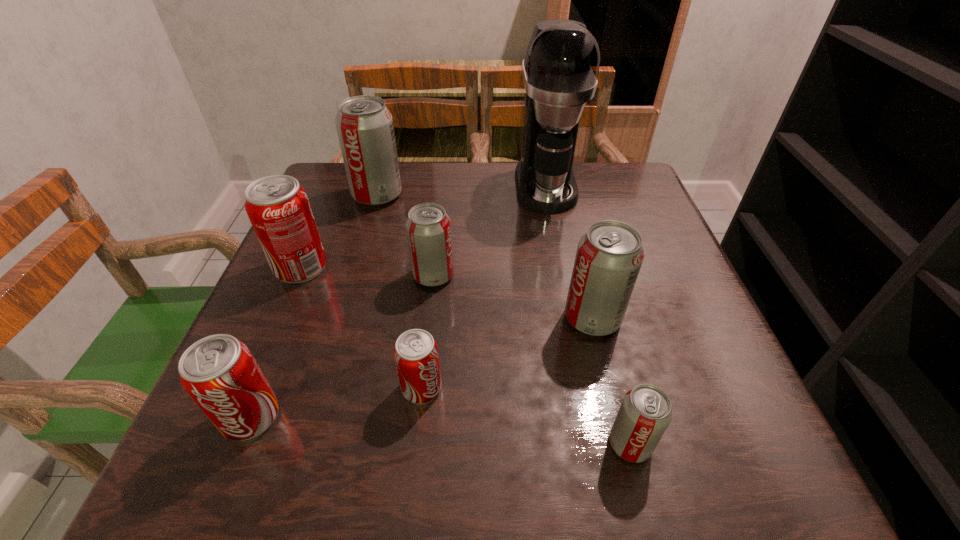
Where is `the smallest gray soda can`? the smallest gray soda can is located at coordinates (645, 413).

Identify the location of vacant space located 0.350m place cup under the spout of the coffee maker. Image resolution: width=960 pixels, height=540 pixels. [x=573, y=328].

This screenshot has width=960, height=540. Identify the location of free region located on the right of the tallest soda can. (490, 195).

Locate an element on the screen. The image size is (960, 540). free space located on the front of the biggest red soda can is located at coordinates (230, 433).

Find the location of a particular element. vacant space located on the back of the fourth farthest soda can is located at coordinates (x=562, y=190).

Locate an element on the screen. vacant area located 0.070m on the back of the second smallest gray soda can is located at coordinates (437, 241).

Image resolution: width=960 pixels, height=540 pixels. Find the location of `blank space located 0.120m on the right of the second biggest red soda can`. blank space located 0.120m on the right of the second biggest red soda can is located at coordinates (357, 417).

The width and height of the screenshot is (960, 540). Identify the location of blank space located 0.050m on the left of the smallest red soda can. (371, 388).

Locate an element on the screen. This screenshot has height=540, width=960. vacant point located on the right of the nearest gray soda can is located at coordinates (706, 444).

The image size is (960, 540). Identify the location of coffee maker present at the far edge. (560, 70).